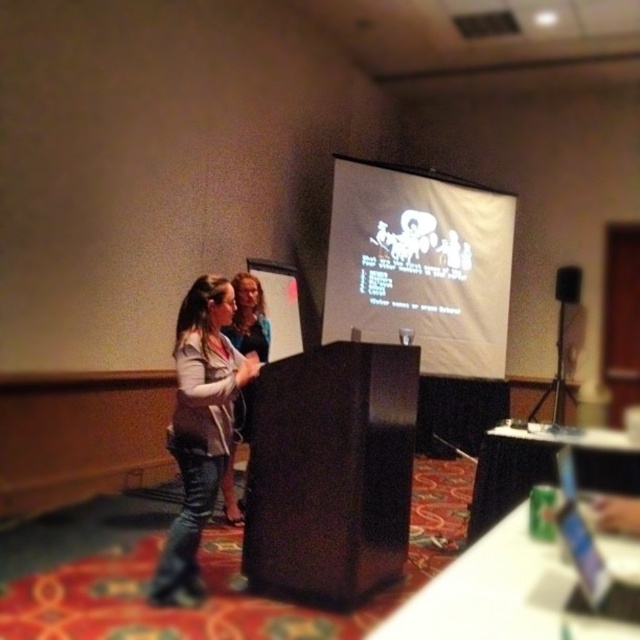
Question: Is white matte projection screen at center above black matte speaker at upper right?

Choices:
 (A) no
 (B) yes

Answer: (B)

Question: Which point is farther from the camera taking this photo?

Choices:
 (A) (579, 278)
 (B) (212, 378)
 (C) (340, 269)

Answer: (A)

Question: Which point is farther to the camera?

Choices:
 (A) black matte speaker at upper right
 (B) white matte projection screen at center

Answer: (A)

Question: Can you confirm if white matte projection screen at center is positioned to the left of denim jacket at left?

Choices:
 (A) no
 (B) yes

Answer: (A)

Question: Can you confirm if white matte projection screen at center is positioned below denim jacket at left?

Choices:
 (A) no
 (B) yes

Answer: (A)

Question: Which object is the farthest from the denim jacket at left?

Choices:
 (A) white matte projection screen at center
 (B) black matte speaker at upper right

Answer: (B)